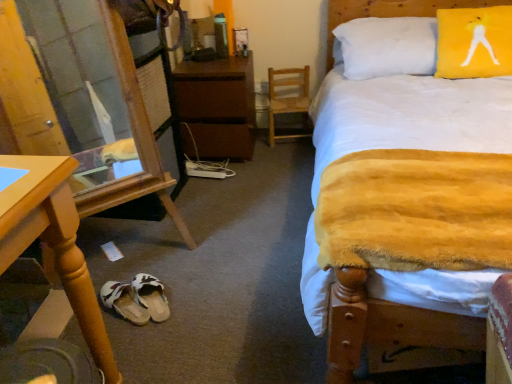
Question: From a real-world perspective, is yellow fabric pillow at upper right on top of transparent glass door at lower left?

Choices:
 (A) no
 (B) yes

Answer: (B)

Question: Considering the relative positions of yellow fabric pillow at upper right and transparent glass door at lower left in the image provided, is yellow fabric pillow at upper right to the right of transparent glass door at lower left from the viewer's perspective?

Choices:
 (A) yes
 (B) no

Answer: (A)

Question: Is yellow fabric pillow at upper right aimed at transparent glass door at lower left?

Choices:
 (A) no
 (B) yes

Answer: (A)

Question: Does yellow fabric pillow at upper right have a greater width compared to transparent glass door at lower left?

Choices:
 (A) yes
 (B) no

Answer: (B)

Question: Is yellow fabric pillow at upper right in contact with transparent glass door at lower left?

Choices:
 (A) no
 (B) yes

Answer: (A)

Question: Considering the relative positions of yellow fabric pillow at upper right and transparent glass door at lower left in the image provided, is yellow fabric pillow at upper right to the left of transparent glass door at lower left from the viewer's perspective?

Choices:
 (A) yes
 (B) no

Answer: (B)

Question: Are transparent glass door at lower left and white fabric slipper at lower center, the 2th footwear in the left-to-right sequence, far apart?

Choices:
 (A) no
 (B) yes

Answer: (A)

Question: Is transparent glass door at lower left located outside white fabric slipper at lower center, which appears as the first footwear when viewed from the right?

Choices:
 (A) yes
 (B) no

Answer: (A)

Question: From the image's perspective, is transparent glass door at lower left beneath white fabric slipper at lower center, which appears as the first footwear when viewed from the right?

Choices:
 (A) yes
 (B) no

Answer: (B)

Question: Is white fabric slipper at lower center, the 2th footwear in the left-to-right sequence, surrounded by transparent glass door at lower left?

Choices:
 (A) no
 (B) yes

Answer: (A)

Question: Is transparent glass door at lower left shorter than white fabric slipper at lower center, which appears as the first footwear when viewed from the right?

Choices:
 (A) no
 (B) yes

Answer: (A)

Question: Could you tell me if transparent glass door at lower left is facing white fabric slipper at lower center, which appears as the first footwear when viewed from the right?

Choices:
 (A) no
 (B) yes

Answer: (B)

Question: Can you confirm if white fabric slipper at lower center, the 2th footwear in the left-to-right sequence, is wider than wooden desk at lower left?

Choices:
 (A) no
 (B) yes

Answer: (A)